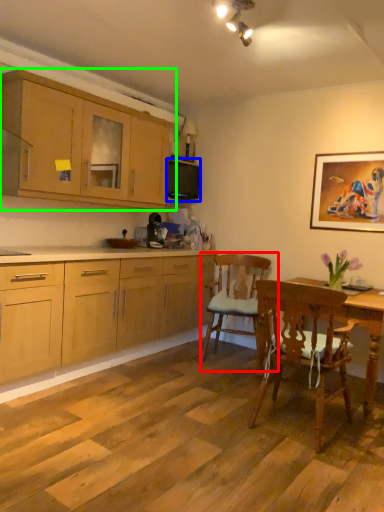
Question: Which is farther away from chair (highlighted by a red box)? microwave oven (highlighted by a blue box) or cabinetry (highlighted by a green box)?

Choices:
 (A) microwave oven
 (B) cabinetry

Answer: (B)